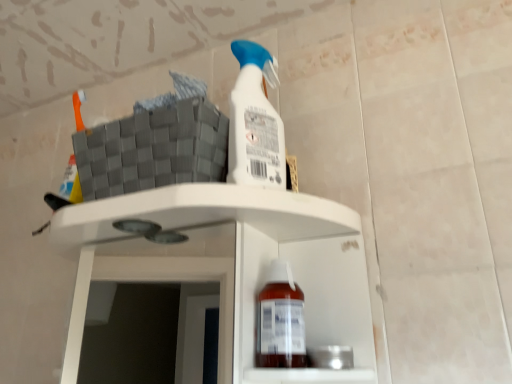
Question: From a real-world perspective, is translucent plastic bottle at lower center positioned above or below white matte shelf at center?

Choices:
 (A) below
 (B) above

Answer: (A)

Question: Is translucent plastic bottle at lower center to the left or to the right of white matte shelf at center in the image?

Choices:
 (A) left
 (B) right

Answer: (B)

Question: Is translucent plastic bottle at lower center inside the boundaries of white matte shelf at center, or outside?

Choices:
 (A) outside
 (B) inside

Answer: (B)

Question: Considering the relative positions of white matte shelf at center and translucent plastic bottle at lower center in the image provided, is white matte shelf at center to the left or to the right of translucent plastic bottle at lower center?

Choices:
 (A) left
 (B) right

Answer: (A)

Question: From the image's perspective, relative to translucent plastic bottle at lower center, is white matte shelf at center above or below?

Choices:
 (A) below
 (B) above

Answer: (A)

Question: Relative to translucent plastic bottle at lower center, is white matte shelf at center in front or behind?

Choices:
 (A) behind
 (B) front

Answer: (B)

Question: Considering the positions of white matte shelf at center and translucent plastic bottle at lower center in the image, is white matte shelf at center taller or shorter than translucent plastic bottle at lower center?

Choices:
 (A) tall
 (B) short

Answer: (A)